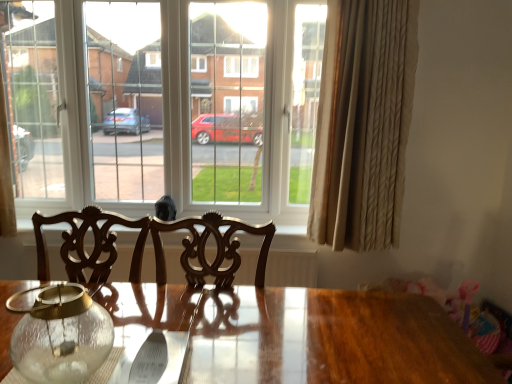
Question: Does transparent glass jar at lower left contain clear glass window at center?

Choices:
 (A) yes
 (B) no

Answer: (B)

Question: Is transparent glass jar at lower left positioned behind clear glass window at center?

Choices:
 (A) no
 (B) yes

Answer: (A)

Question: Is transparent glass jar at lower left turned away from clear glass window at center?

Choices:
 (A) yes
 (B) no

Answer: (A)

Question: Considering the relative sizes of transparent glass jar at lower left and clear glass window at center in the image provided, is transparent glass jar at lower left taller than clear glass window at center?

Choices:
 (A) yes
 (B) no

Answer: (B)

Question: Is transparent glass jar at lower left thinner than clear glass window at center?

Choices:
 (A) no
 (B) yes

Answer: (B)

Question: From a real-world perspective, relative to transparent glass jar at lower left, is beige textured curtain at right vertically above or below?

Choices:
 (A) below
 (B) above

Answer: (B)

Question: Considering the positions of point (373, 44) and point (68, 365), is point (373, 44) closer or farther from the camera than point (68, 365)?

Choices:
 (A) closer
 (B) farther

Answer: (B)

Question: Considering their positions, is beige textured curtain at right located in front of or behind transparent glass jar at lower left?

Choices:
 (A) behind
 (B) front

Answer: (A)

Question: From the image's perspective, is beige textured curtain at right located above or below transparent glass jar at lower left?

Choices:
 (A) above
 (B) below

Answer: (A)

Question: Looking at the image, does transparent glass jar at lower left seem bigger or smaller compared to beige textured curtain at right?

Choices:
 (A) big
 (B) small

Answer: (B)

Question: From the image's perspective, is transparent glass jar at lower left positioned above or below beige textured curtain at right?

Choices:
 (A) above
 (B) below

Answer: (B)

Question: In the image, is transparent glass jar at lower left positioned in front of or behind beige textured curtain at right?

Choices:
 (A) behind
 (B) front

Answer: (B)

Question: From a real-world perspective, is transparent glass jar at lower left positioned above or below beige textured curtain at right?

Choices:
 (A) below
 (B) above

Answer: (A)

Question: Is beige textured curtain at right wider or thinner than clear glass window at center?

Choices:
 (A) wide
 (B) thin

Answer: (B)

Question: Do you think beige textured curtain at right is within clear glass window at center, or outside of it?

Choices:
 (A) inside
 (B) outside

Answer: (B)